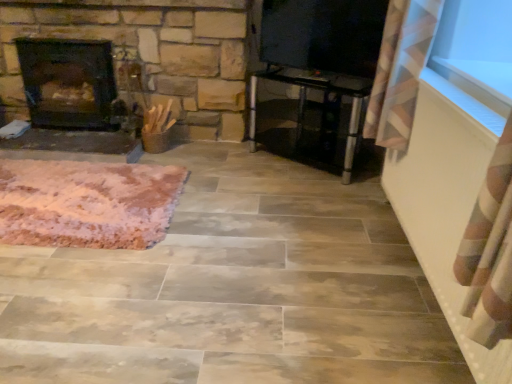
Question: Considering the relative positions of transparent glass table at center and pink fluffy rug at lower left in the image provided, is transparent glass table at center to the left or to the right of pink fluffy rug at lower left?

Choices:
 (A) left
 (B) right

Answer: (B)

Question: Is transparent glass table at center in front of or behind pink fluffy rug at lower left in the image?

Choices:
 (A) front
 (B) behind

Answer: (B)

Question: Which object is positioned closest to the dark brown stone fireplace at left?

Choices:
 (A) pink fluffy rug at lower left
 (B) transparent glass table at center
 (C) transparent glass window screen at upper right

Answer: (A)

Question: Based on their relative distances, which object is nearer to the transparent glass window screen at upper right?

Choices:
 (A) transparent glass table at center
 (B) dark brown stone fireplace at left
 (C) pink fluffy rug at lower left

Answer: (A)